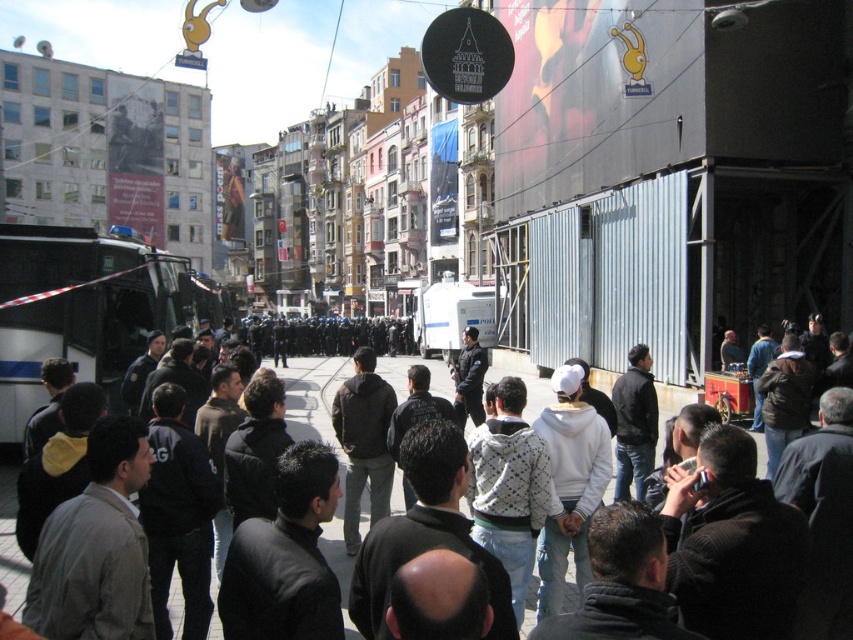
Question: Which object appears farthest from the camera in this image?

Choices:
 (A) brushed metal bus at left
 (B) dark gray jacket at center

Answer: (A)

Question: Which object is farther from the camera taking this photo?

Choices:
 (A) dark gray jacket at center
 (B) brushed metal bus at left

Answer: (B)

Question: From the image, what is the correct spatial relationship of brushed metal bus at left in relation to dark gray jacket at center?

Choices:
 (A) above
 (B) below

Answer: (A)

Question: Which object is farther from the camera taking this photo?

Choices:
 (A) brushed metal bus at left
 (B) dark gray jacket at center

Answer: (A)

Question: From the image, what is the correct spatial relationship of brushed metal bus at left in relation to dark gray jacket at center?

Choices:
 (A) left
 (B) right

Answer: (A)

Question: Does brushed metal bus at left appear under dark gray jacket at center?

Choices:
 (A) yes
 (B) no

Answer: (B)